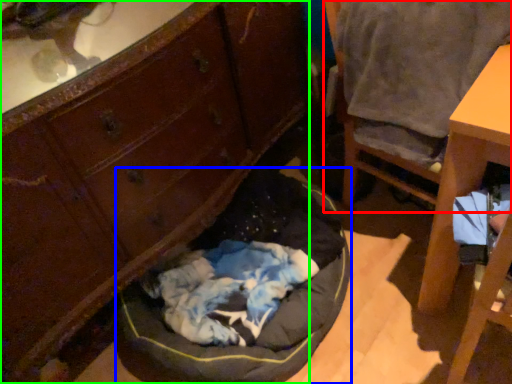
Question: Estimate the real-world distances between objects in this image. Which object is closer to chair (highlighted by a red box), dog bed (highlighted by a blue box) or cabinetry (highlighted by a green box)?

Choices:
 (A) dog bed
 (B) cabinetry

Answer: (B)